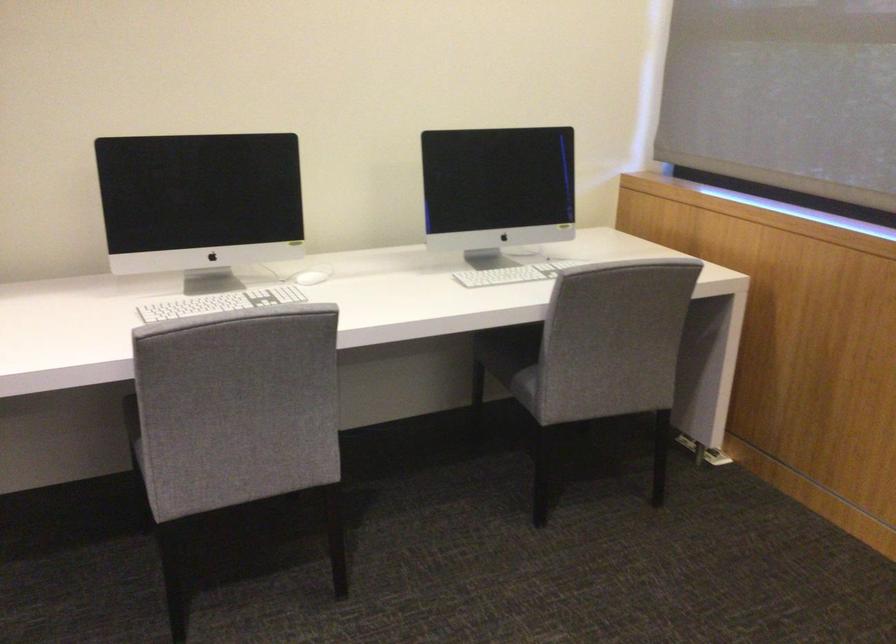
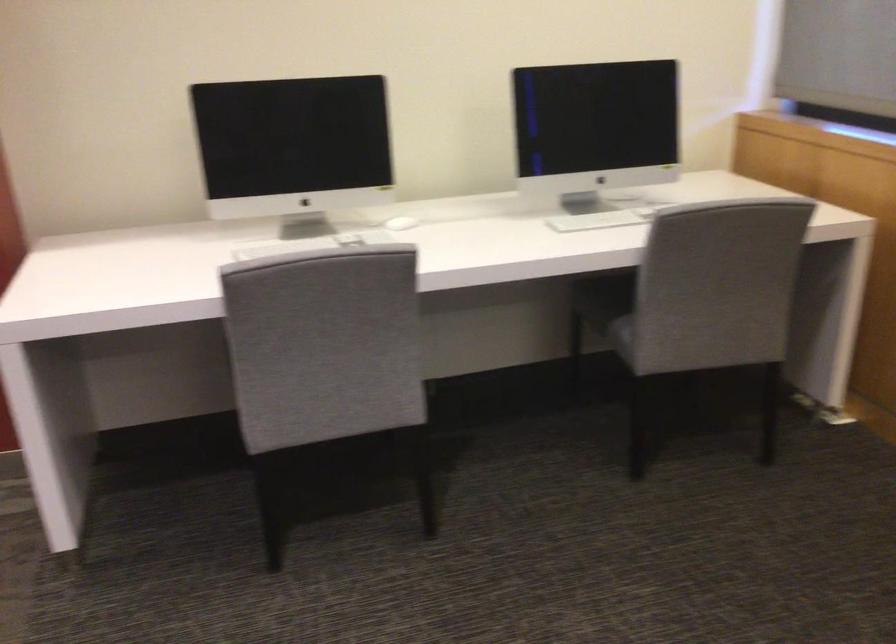
Question: Based on the continuous images, in which direction is the camera rotating? Reply with the corresponding letter.

Choices:
 (A) Left
 (B) Right
 (C) Up
 (D) Down

Answer: (A)